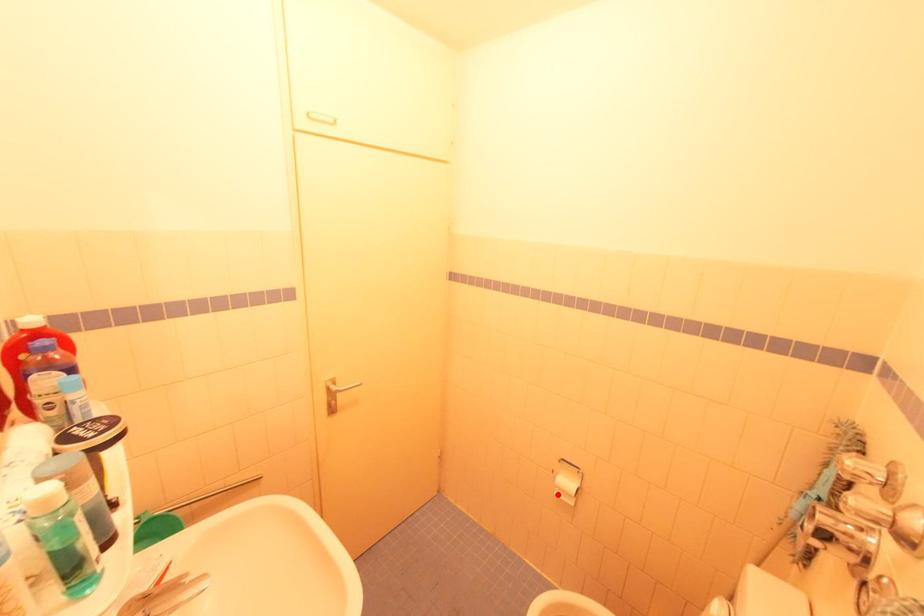
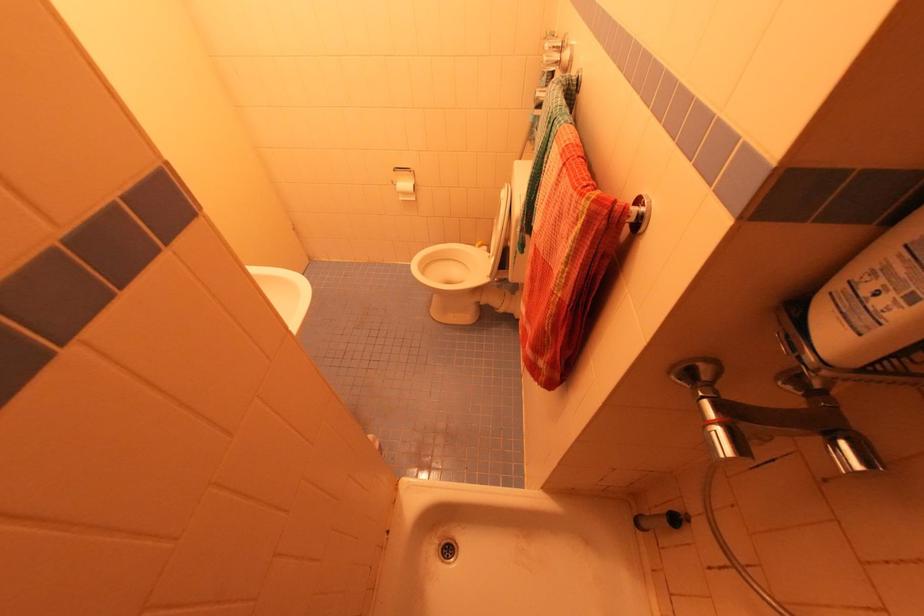
Question: I am providing you with two images of the same scene from different viewpoints. In image1, a red point is highlighted. Considering the same 3D point in image2, which of the following is correct?

Choices:
 (A) It is closer
 (B) It is farther

Answer: (A)